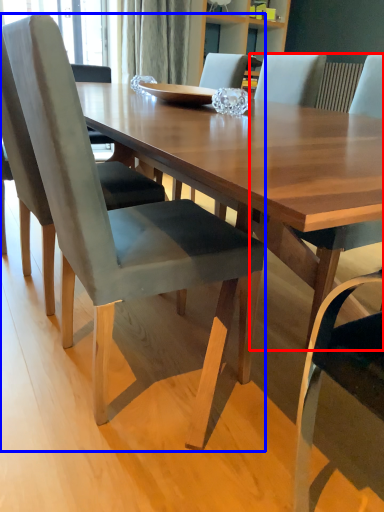
Question: Which point is further to the camera, chair (highlighted by a red box) or chair (highlighted by a blue box)?

Choices:
 (A) chair
 (B) chair

Answer: (A)